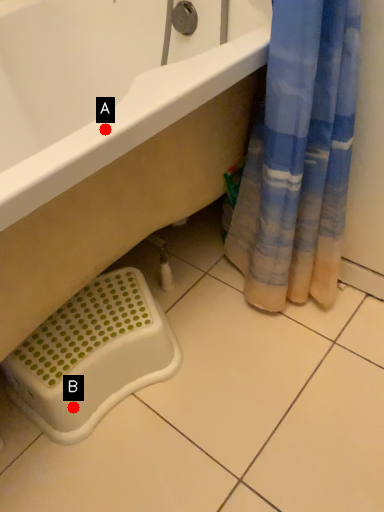
Question: Two points are circled on the image, labeled by A and B beside each circle. Which point is further to the camera?

Choices:
 (A) A is further
 (B) B is further

Answer: (B)